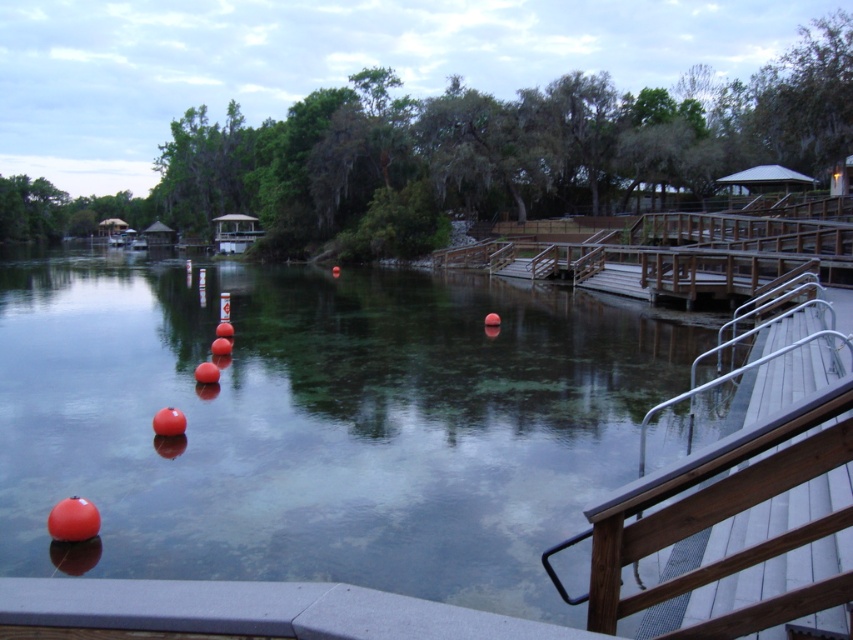
Question: Is transparent water at center above metal/wooden handrail at right?

Choices:
 (A) no
 (B) yes

Answer: (B)

Question: Which object is farther from the camera taking this photo?

Choices:
 (A) metal/wooden handrail at right
 (B) transparent water at center

Answer: (B)

Question: Which of the following is the farthest from the observer?

Choices:
 (A) metal/wooden handrail at right
 (B) transparent water at center

Answer: (B)

Question: Can you confirm if transparent water at center is positioned above metal/wooden handrail at right?

Choices:
 (A) yes
 (B) no

Answer: (A)

Question: Does transparent water at center have a smaller size compared to metal/wooden handrail at right?

Choices:
 (A) no
 (B) yes

Answer: (A)

Question: Which point is closer to the camera?

Choices:
 (A) metal/wooden handrail at right
 (B) transparent water at center

Answer: (A)